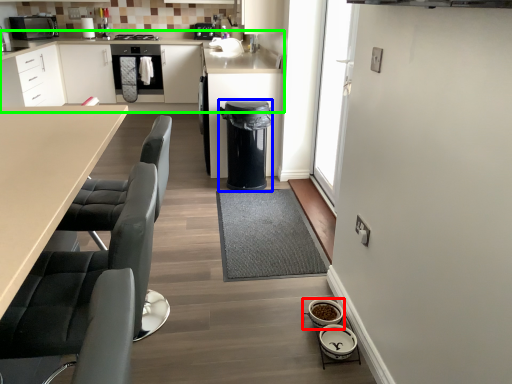
Question: Considering the real-world distances, which object is farthest from appliance (highlighted by a red box)? dish washer (highlighted by a blue box) or cabinetry (highlighted by a green box)?

Choices:
 (A) dish washer
 (B) cabinetry

Answer: (B)